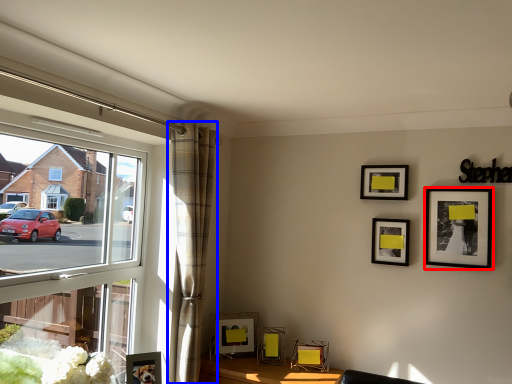
Question: Which of the following is the closest to the observer, picture frame (highlighted by a red box) or curtain (highlighted by a blue box)?

Choices:
 (A) picture frame
 (B) curtain

Answer: (B)